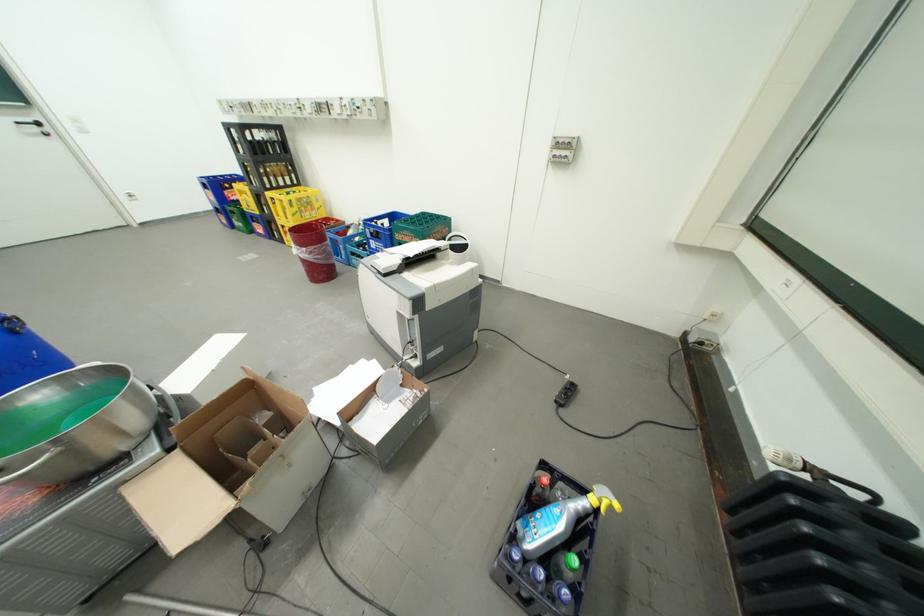
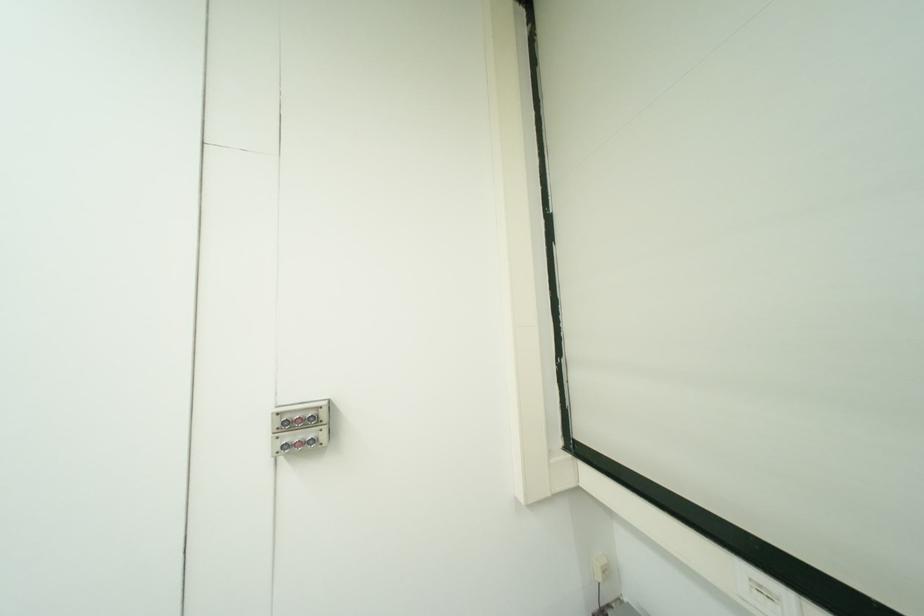
The first image is from the beginning of the video and the second image is from the end. How did the camera likely rotate when shooting the video?

The camera rotated toward right-up.